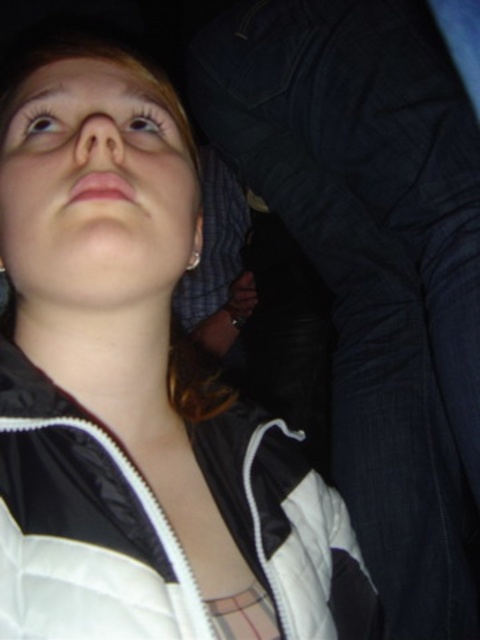
Question: Does light brown eye at upper left come in front of shiny brown eye at upper left?

Choices:
 (A) no
 (B) yes

Answer: (B)

Question: Which object is farther from the camera taking this photo?

Choices:
 (A) shiny brown eye at upper left
 (B) light brown eye at upper left

Answer: (A)

Question: Does light brown eye at upper left appear over shiny brown eye at upper left?

Choices:
 (A) no
 (B) yes

Answer: (A)

Question: Can you confirm if light brown eye at upper left is positioned below shiny brown eye at upper left?

Choices:
 (A) no
 (B) yes

Answer: (B)